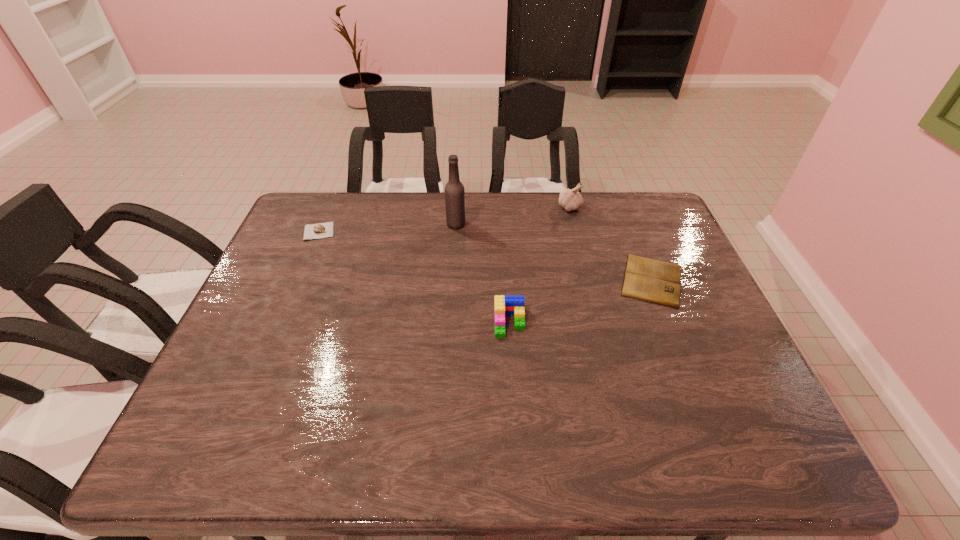
Where is `free space that satisfies the following two spatial constraints: 1. on the label of the second object from left to right; 2. on the back side of the third object from right to left`? free space that satisfies the following two spatial constraints: 1. on the label of the second object from left to right; 2. on the back side of the third object from right to left is located at coordinates 450,322.

Identify the location of free point that satisfies the following two spatial constraints: 1. on the back side of the shortest object; 2. on the label of the second object from left to right. The width and height of the screenshot is (960, 540). (630, 224).

You are a GUI agent. You are given a task and a screenshot of the screen. Output one action in this format:
    pyautogui.click(x=<x>, y=<y>)
    Task: Click on the vacant space that satisfies the following two spatial constraints: 1. on the back side of the third object from left to right; 2. on the right side of the second tallest object
    Image resolution: width=960 pixels, height=540 pixels.
    Given the screenshot: What is the action you would take?
    pyautogui.click(x=502, y=207)

Identify the location of free space that satisfies the following two spatial constraints: 1. on the label of the beer bottle; 2. on the back side of the rightmost object. (452, 280).